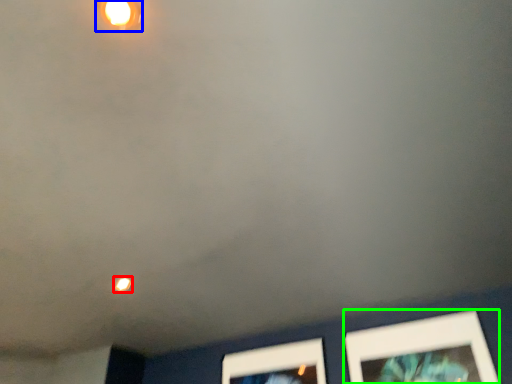
Question: Estimate the real-world distances between objects in this image. Which object is farther from light (highlighted by a red box), light fixture (highlighted by a blue box) or picture frame (highlighted by a green box)?

Choices:
 (A) light fixture
 (B) picture frame

Answer: (B)